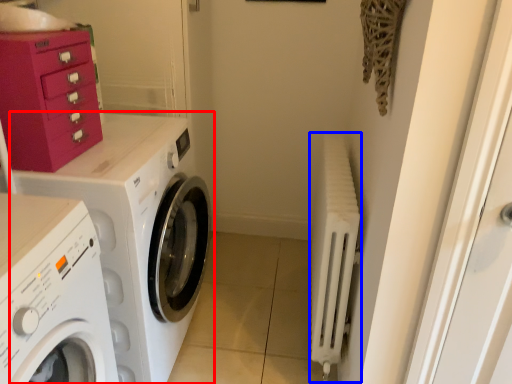
Question: Among these objects, which one is nearest to the camera, washing machine (highlighted by a red box) or radiator (highlighted by a blue box)?

Choices:
 (A) washing machine
 (B) radiator

Answer: (A)